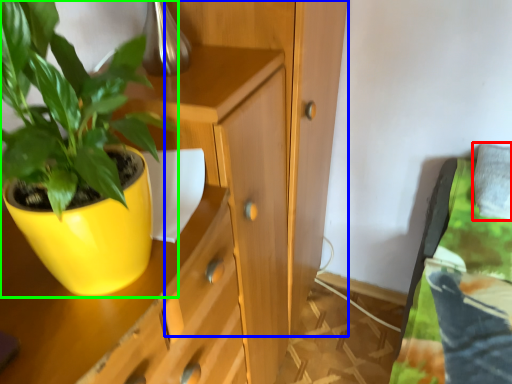
Question: Which object is positioned farthest from pillow (highlighted by a red box)? Select from dresser (highlighted by a blue box) and houseplant (highlighted by a green box).

Choices:
 (A) dresser
 (B) houseplant

Answer: (B)